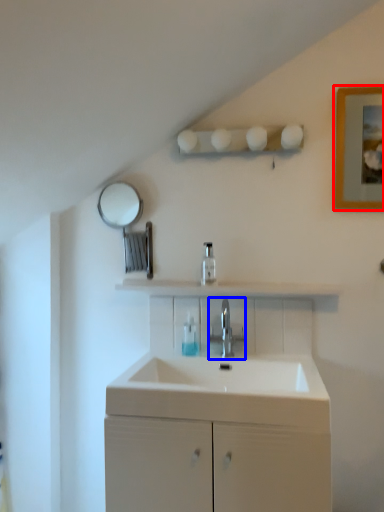
Question: Which object is further to the camera taking this photo, picture frame (highlighted by a red box) or tap (highlighted by a blue box)?

Choices:
 (A) picture frame
 (B) tap

Answer: (B)